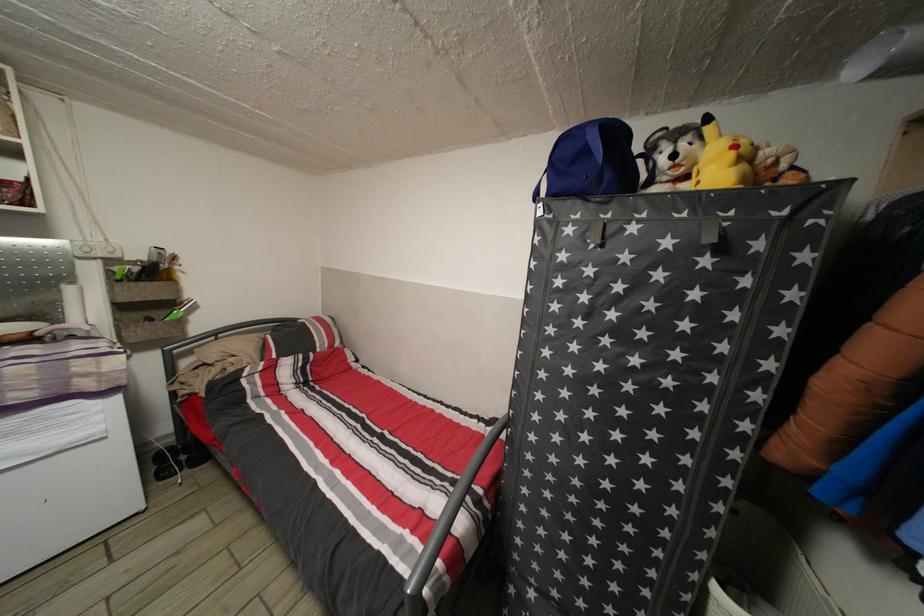
Image resolution: width=924 pixels, height=616 pixels. Find the location of `white laundry basket`. white laundry basket is located at coordinates (760, 570).